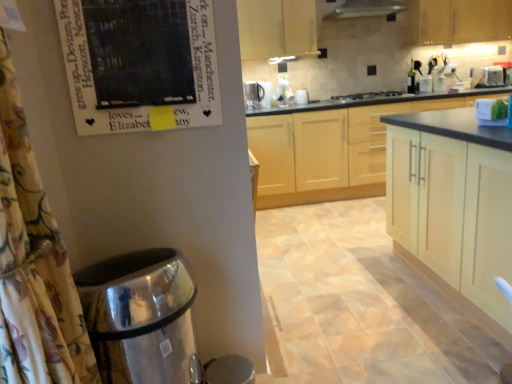
Question: From a real-world perspective, is floral fabric shower curtain at left above or below green glass bottle at upper right?

Choices:
 (A) above
 (B) below

Answer: (B)

Question: In terms of height, does floral fabric shower curtain at left look taller or shorter compared to green glass bottle at upper right?

Choices:
 (A) short
 (B) tall

Answer: (B)

Question: Based on their relative distances, which object is farther from the floral fabric shower curtain at left?

Choices:
 (A) green glass bottle at upper right
 (B) matte white faucet at upper center
 (C) light wood cabinet at upper center, which appears as the 2th cabinetry when viewed from the back
 (D) black glass stove at center
 (E) light wood cabinet at center, acting as the fourth cabinetry starting from the back

Answer: (A)

Question: Estimate the real-world distances between objects in this image. Which object is farther from the white glossy exhaust hood at upper center?

Choices:
 (A) black matte poster at upper left
 (B) light wood cabinets at center, which is the second cabinetry from front to back
 (C) metallic silver mug at upper center
 (D) floral fabric shower curtain at left
 (E) light wood cabinet at upper center, which appears as the 2th cabinetry when viewed from the back

Answer: (D)